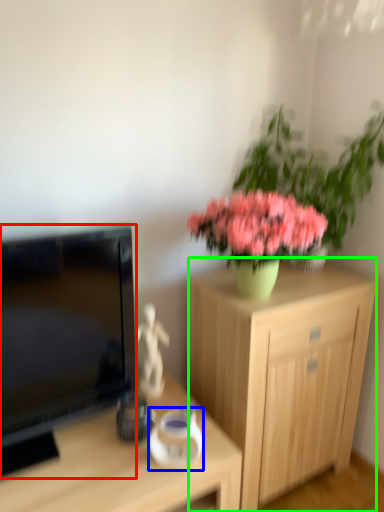
Question: Which object is positioned farthest from television (highlighted by a red box)? Select from vase (highlighted by a blue box) and cabinetry (highlighted by a green box).

Choices:
 (A) vase
 (B) cabinetry

Answer: (B)